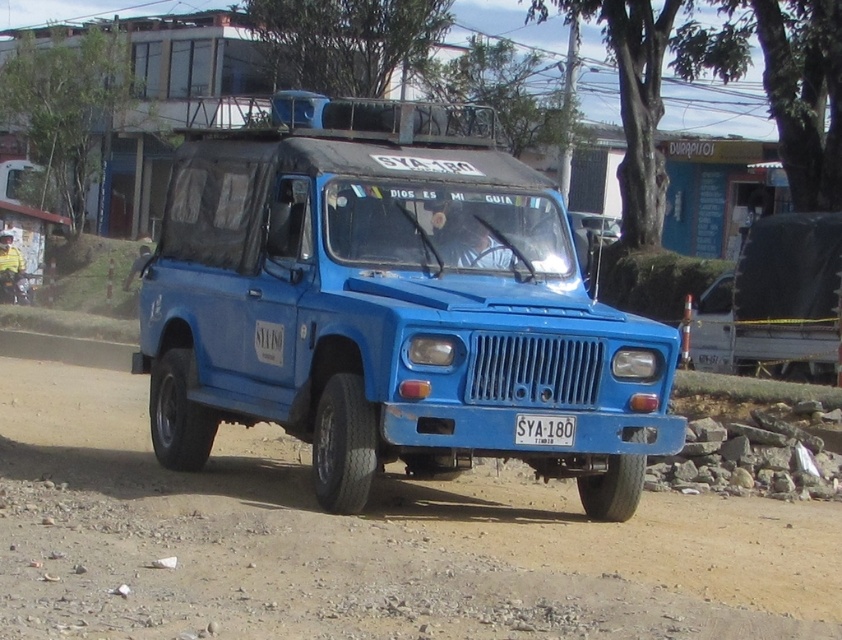
Based on the photo, who is positioned more to the left, blue matte jeep at center or dirt field at center?

blue matte jeep at center is more to the left.

Is point (148, 417) positioned in front of point (609, 616)?

No, it is not.

Locate an element on the screen. The image size is (842, 640). blue matte jeep at center is located at coordinates (388, 305).

Find the location of a particular element. The width and height of the screenshot is (842, 640). blue matte jeep at center is located at coordinates (388, 305).

Who is shorter, dirt field at center or white plastic license plate at center?

white plastic license plate at center

Can you confirm if dirt field at center is wider than white plastic license plate at center?

Yes.

Find the location of a particular element. dirt field at center is located at coordinates (364, 541).

Image resolution: width=842 pixels, height=640 pixels. Find the location of `dirt field at center`. dirt field at center is located at coordinates point(364,541).

Which is more to the right, blue matte jeep at center or white plastic license plate at center?

white plastic license plate at center

Which is more to the left, blue matte jeep at center or white plastic license plate at center?

Positioned to the left is blue matte jeep at center.

What do you see at coordinates (388, 305) in the screenshot?
I see `blue matte jeep at center` at bounding box center [388, 305].

Find the location of a particular element. blue matte jeep at center is located at coordinates (388, 305).